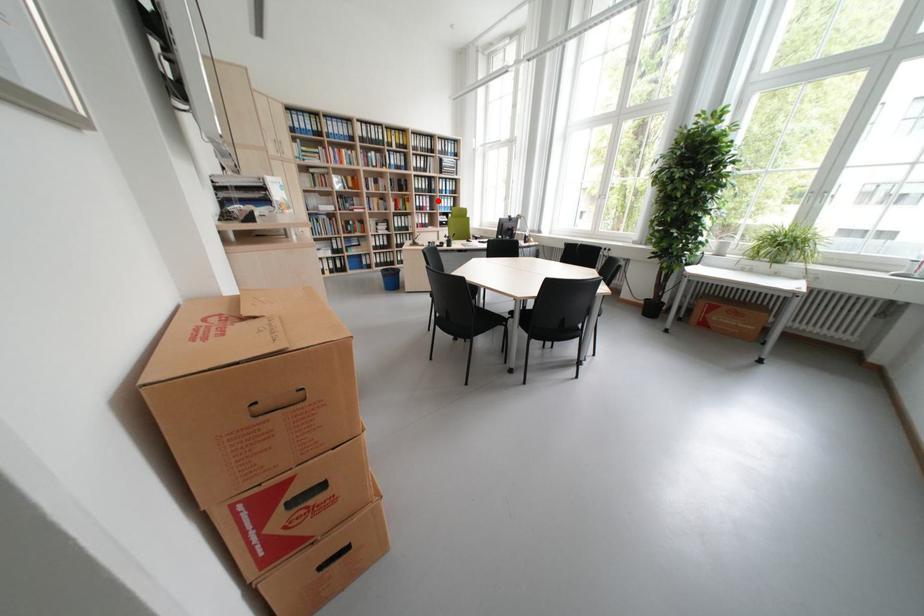
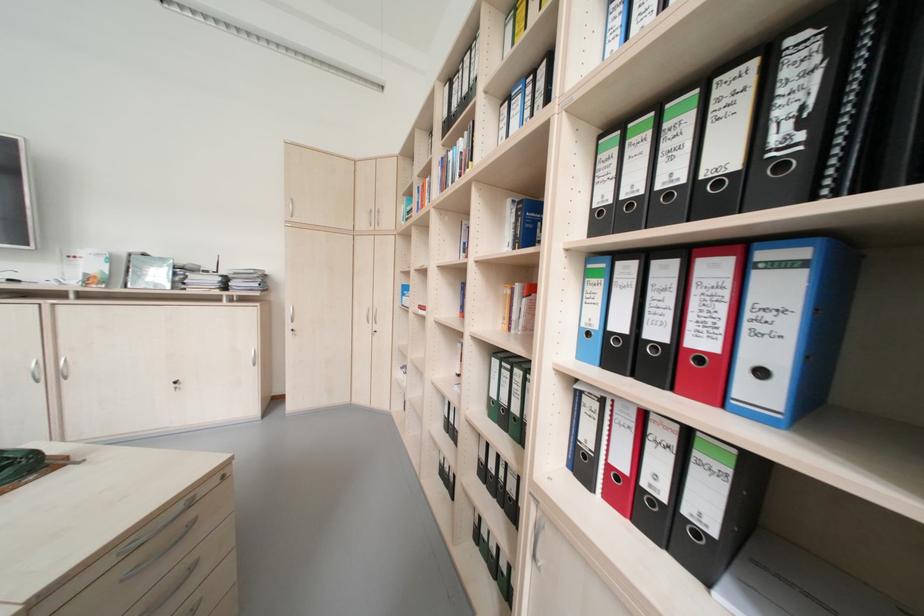
Question: I am providing you with two images of the same scene from different viewpoints. A red point is shown in image1. For the corresponding object point in image2, is it positioned nearer or farther from the camera?

Choices:
 (A) Nearer
 (B) Farther

Answer: (B)